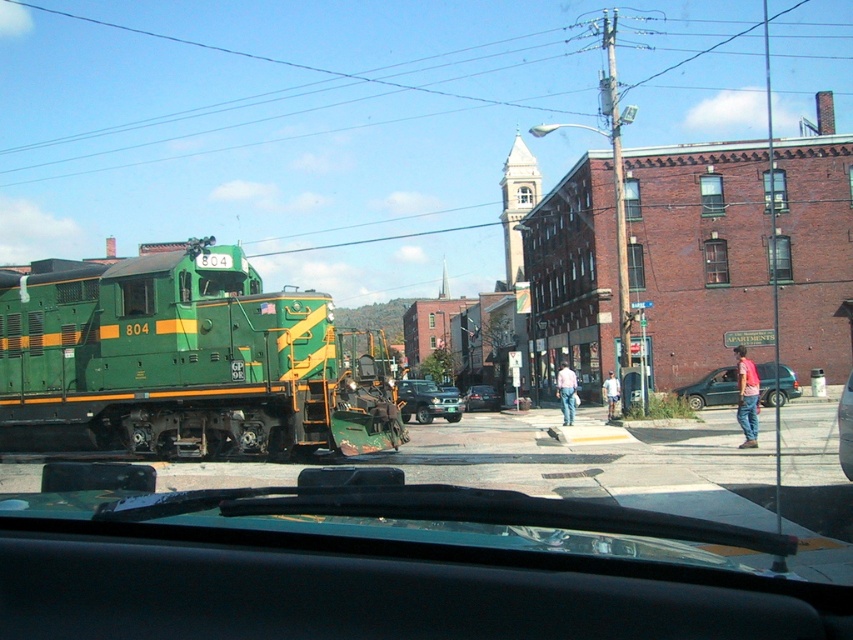
Question: Which point is farther to the camera?

Choices:
 (A) green matte truck at center
 (B) green matte train at left
 (C) metallic gray van at right

Answer: (C)

Question: Is metallic gray van at right to the left of green matte truck at center from the viewer's perspective?

Choices:
 (A) no
 (B) yes

Answer: (A)

Question: Does green matte train at left appear on the right side of green matte truck at center?

Choices:
 (A) no
 (B) yes

Answer: (A)

Question: Which object is the farthest from the metallic gray van at right?

Choices:
 (A) green matte train at left
 (B) green matte truck at center

Answer: (A)

Question: Is green matte train at left thinner than green matte truck at center?

Choices:
 (A) yes
 (B) no

Answer: (B)

Question: Estimate the real-world distances between objects in this image. Which object is closer to the metallic gray van at right?

Choices:
 (A) green matte truck at center
 (B) green matte train at left

Answer: (A)